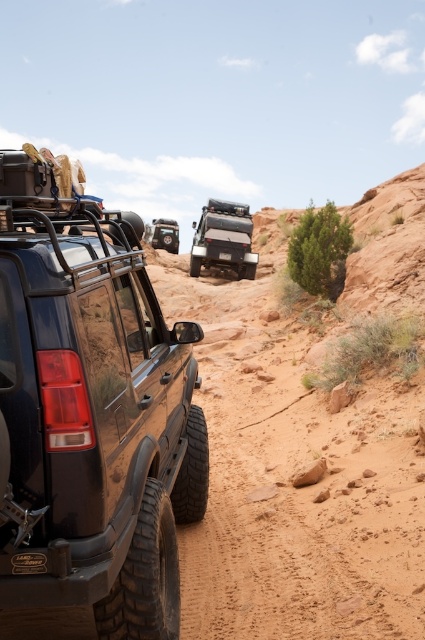
You are a driver planning to take a photo of the matte black jeep at center and the black plastic license plate at center from the front. Which object should you focus on first if you want to capture both in a single frame without moving the camera?

The matte black jeep at center is bigger than the black plastic license plate at center, so you should focus on the matte black jeep at center first to ensure it fits properly in the frame before adjusting for the smaller license plate.

You are a driver planning to cross a desert path. You have a matte black jeep at center and a matte black tire at center in your vehicle. Based on the scene, which object would you need to check first for desert conditions?

The matte black tire at center needs to be checked first because it is larger in size compared to the matte black jeep at center, making it more critical for ensuring proper traction and durability in desert terrain.

You are navigating an offroad SUV and need to follow the path indicated by two points. The first point is at coordinate point (229,218) and the second is at coordinate point (229,257). Which point should you aim for first to stay on the correct path?

You should aim for point (229,257) first because point (229,218) is behind it, so following the path requires starting with the forward point.